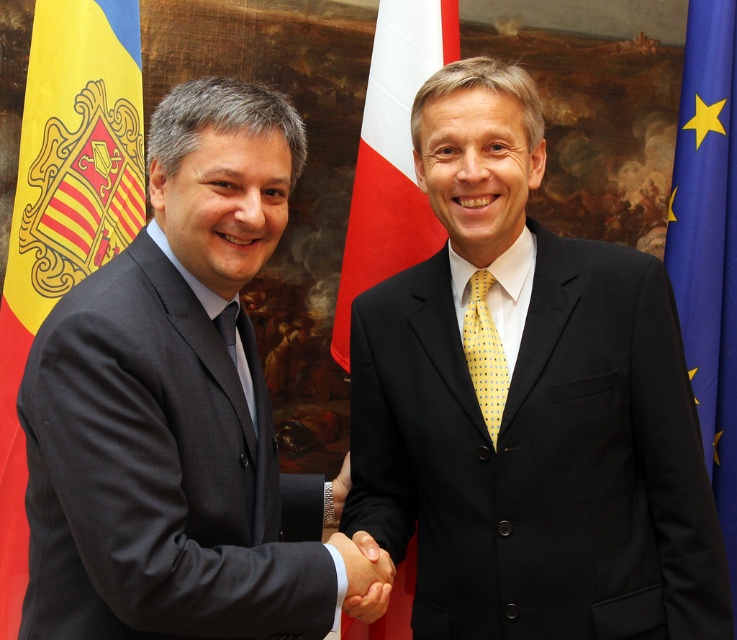
You are standing in the room where the handshake is taking place. There is a point at coordinate (708, 243). What object is located at that point?

The point at coordinate (708, 243) corresponds to the blue fabric flag at right.

You are standing in the room where the handshake is taking place. You want to walk from the point at coordinates point (461, 340) to the point at coordinates point (349, 481). Which direction should you move in to get there?

You should move towards the direction away from the viewer since point (349, 481) is further away than point (461, 340).

Based on the photo, you are a photographer at the event and want to capture a clear photo of the black leather wristband at center without the blue fabric flag at right blocking it. What should you do?

Move to the left side so that the black leather wristband at center is no longer behind the blue fabric flag at right.